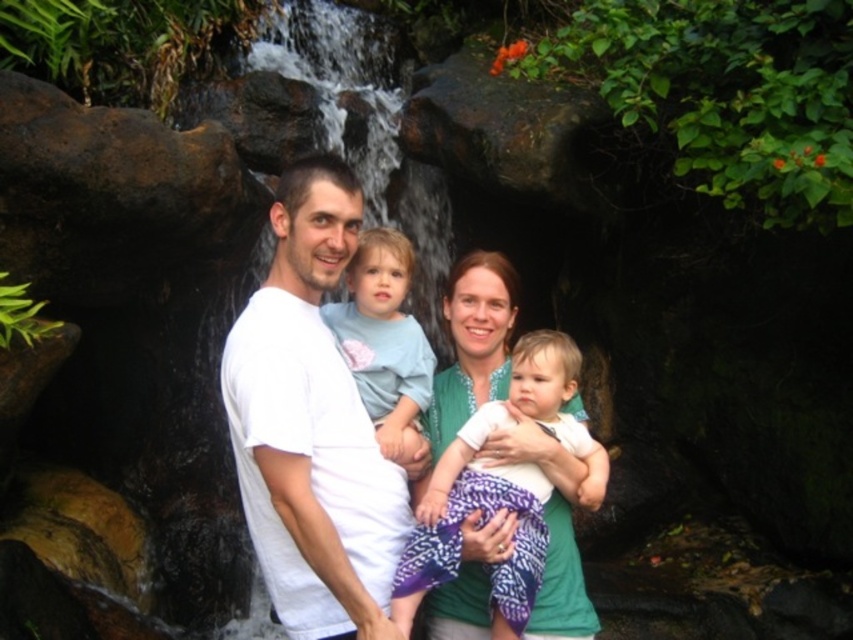
In the scene shown: Does white cotton shirt at center have a lesser height compared to green textured dress at center?

Incorrect, white cotton shirt at center's height does not fall short of green textured dress at center's.

Does white cotton shirt at center have a larger size compared to green textured dress at center?

Indeed, white cotton shirt at center has a larger size compared to green textured dress at center.

Is point (300, 576) positioned before point (485, 353)?

Yes, point (300, 576) is in front of point (485, 353).

Locate an element on the screen. The width and height of the screenshot is (853, 640). white cotton shirt at center is located at coordinates pyautogui.click(x=311, y=426).

Looking at this image, can you confirm if green textured dress at center is positioned to the left of light blue cotton shirt at center?

No, green textured dress at center is not to the left of light blue cotton shirt at center.

Does green textured dress at center have a lesser width compared to light blue cotton shirt at center?

Yes.

Is point (540, 458) behind point (341, 305)?

No, it is in front of (341, 305).

Image resolution: width=853 pixels, height=640 pixels. I want to click on green textured dress at center, so click(474, 340).

Can you confirm if white cotton shirt at center is shorter than light blue cotton shirt at center?

In fact, white cotton shirt at center may be taller than light blue cotton shirt at center.

Consider the image. Does white cotton shirt at center have a larger size compared to light blue cotton shirt at center?

Yes.

Locate an element on the screen. white cotton shirt at center is located at coordinates (311, 426).

The height and width of the screenshot is (640, 853). In order to click on white cotton shirt at center in this screenshot , I will do (311, 426).